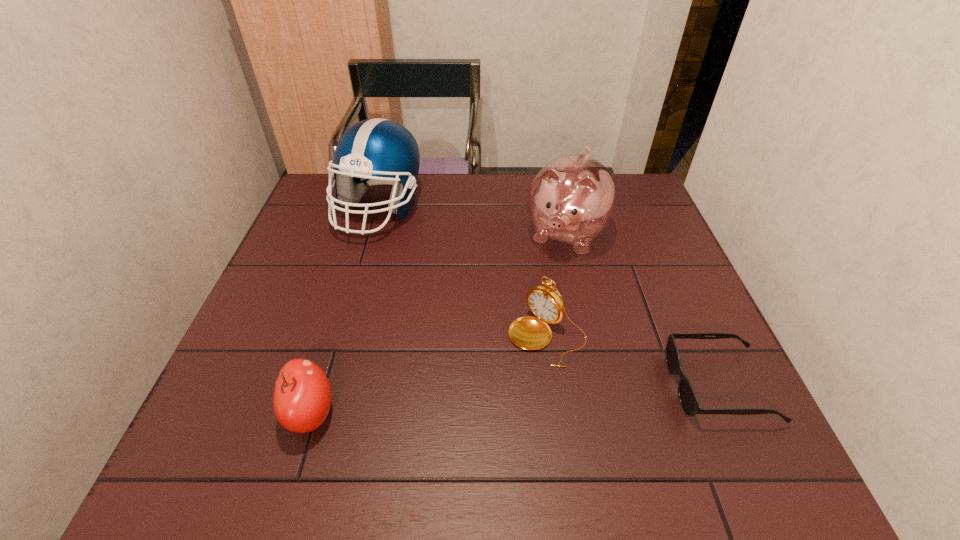
At what (x,y) coordinates should I click in order to perform the action: click on apple. Please return your answer as a coordinate pair (x, y). Looking at the image, I should click on (302, 395).

The image size is (960, 540). What are the coordinates of `the shortest object` in the screenshot? It's located at tap(688, 399).

Locate an element on the screen. This screenshot has width=960, height=540. sunglasses is located at coordinates (688, 399).

This screenshot has width=960, height=540. In order to click on piggy bank in this screenshot , I will do `click(572, 198)`.

Identify the location of pocket watch. This screenshot has height=540, width=960. (531, 333).

The height and width of the screenshot is (540, 960). I want to click on football helmet, so click(377, 151).

The width and height of the screenshot is (960, 540). Identify the location of vacant space located on the stem of the apple. (244, 413).

I want to click on blank space located on the stem of the apple, so click(207, 413).

Identify the location of blank area located on the stem of the apple. (212, 413).

Where is `free space located 0.310m at the front lenses of the shortest object`? Image resolution: width=960 pixels, height=540 pixels. free space located 0.310m at the front lenses of the shortest object is located at coordinates (519, 386).